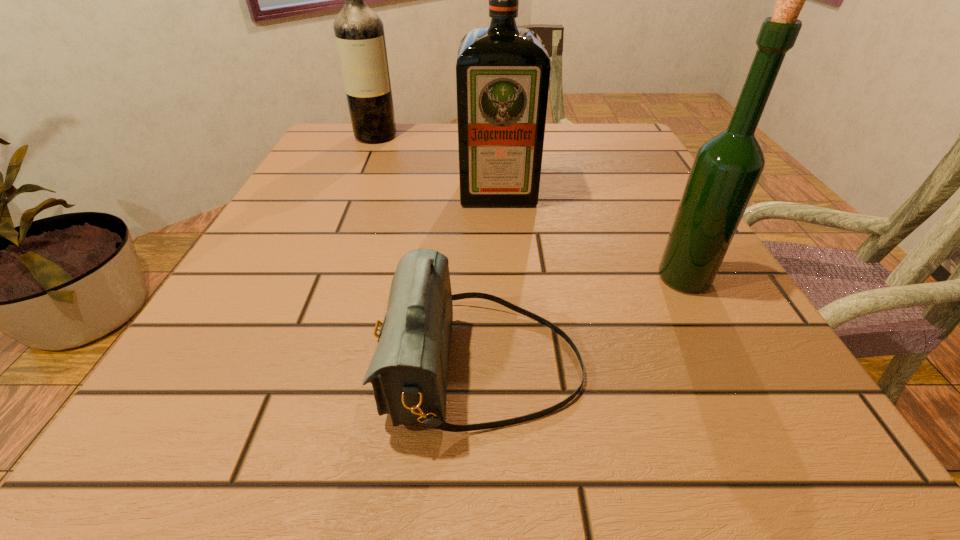
Identify the location of free space at the right edge of the desktop. This screenshot has width=960, height=540. [x=644, y=173].

The height and width of the screenshot is (540, 960). Identify the location of vacant region at the near left corner. (237, 444).

Locate an element on the screen. This screenshot has width=960, height=540. free space at the far right corner is located at coordinates (621, 164).

Identify the location of vacant area between the second farthest object and the shoulder bag. (491, 280).

Where is `empty space between the nearest liquor and the second farthest liquor`? The width and height of the screenshot is (960, 540). empty space between the nearest liquor and the second farthest liquor is located at coordinates (591, 235).

Locate an element on the screen. free space between the shortest object and the third farthest object is located at coordinates (584, 322).

Where is `free spot between the shoulder bag and the second nearest object`? The image size is (960, 540). free spot between the shoulder bag and the second nearest object is located at coordinates (584, 322).

At what (x,y) coordinates should I click in order to perform the action: click on free space between the second nearest liquor and the rightmost object. Please return your answer as a coordinate pair (x, y). The width and height of the screenshot is (960, 540). Looking at the image, I should click on point(591,235).

The image size is (960, 540). Find the location of `vacant space in between the second liquor from left to right and the shoulder bag`. vacant space in between the second liquor from left to right and the shoulder bag is located at coordinates (491, 280).

Locate which object ranks third in proximity to the farthest liquor. Please provide its 2D coordinates. Your answer should be formatted as a tuple, i.e. [(x, y)], where the tuple contains the x and y coordinates of a point satisfying the conditions above.

[(726, 169)]